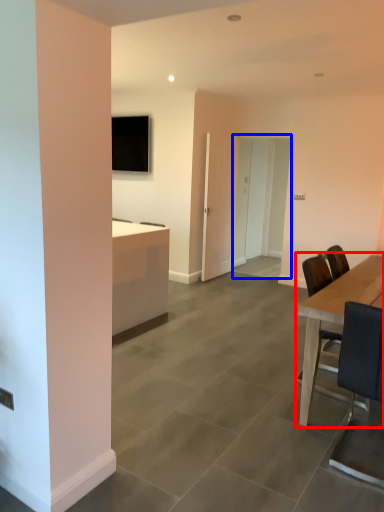
Question: Which point is further to the camera, table (highlighted by a red box) or glass door (highlighted by a blue box)?

Choices:
 (A) table
 (B) glass door

Answer: (B)